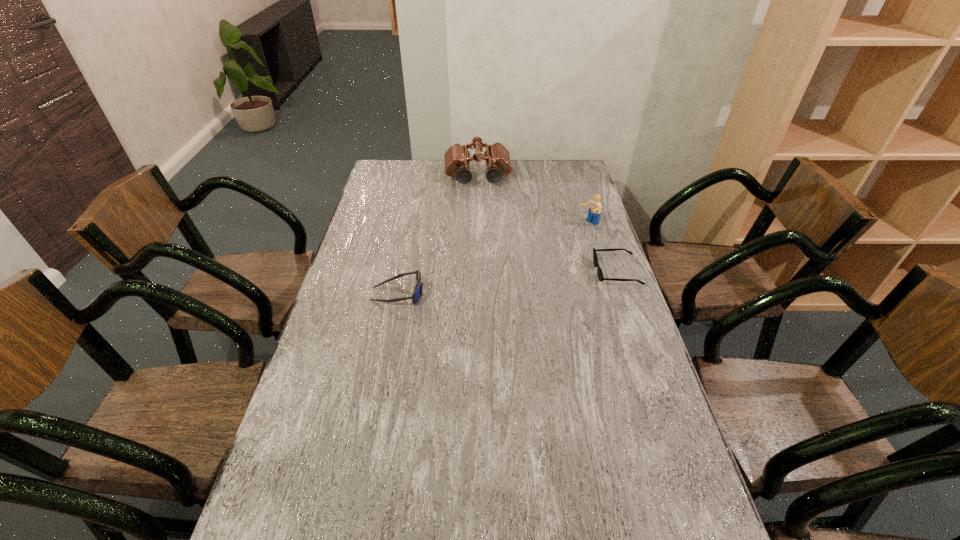
The width and height of the screenshot is (960, 540). What are the coordinates of `sunglasses situated at the right edge` in the screenshot? It's located at (599, 271).

Locate an element on the screen. Lego present at the right edge is located at coordinates (594, 212).

Locate an element on the screen. The image size is (960, 540). vacant space at the far edge of the desktop is located at coordinates (528, 161).

I want to click on vacant area at the near edge, so click(x=553, y=521).

This screenshot has height=540, width=960. Identify the location of vacant area at the left edge of the desktop. (372, 310).

Find the location of `free spot at the right edge of the desktop`. free spot at the right edge of the desktop is located at coordinates (585, 328).

The width and height of the screenshot is (960, 540). I want to click on vacant space at the far left corner of the desktop, so click(388, 171).

You are a GUI agent. You are given a task and a screenshot of the screen. Output one action in this format:
    pyautogui.click(x=<x>, y=<y>)
    Task: Click on the vacant area at the far right corner
    The width and height of the screenshot is (960, 540).
    Given the screenshot: What is the action you would take?
    pyautogui.click(x=579, y=182)

You are a GUI agent. You are given a task and a screenshot of the screen. Output one action in this format:
    pyautogui.click(x=<x>, y=<y>)
    Task: Click on the free space that is in between the third object from right to left and the leftmost object
    The image size is (960, 540).
    Given the screenshot: What is the action you would take?
    pos(438,235)

Image resolution: width=960 pixels, height=540 pixels. In order to click on free space between the tallest object and the second shortest object in this screenshot , I will do `click(438, 235)`.